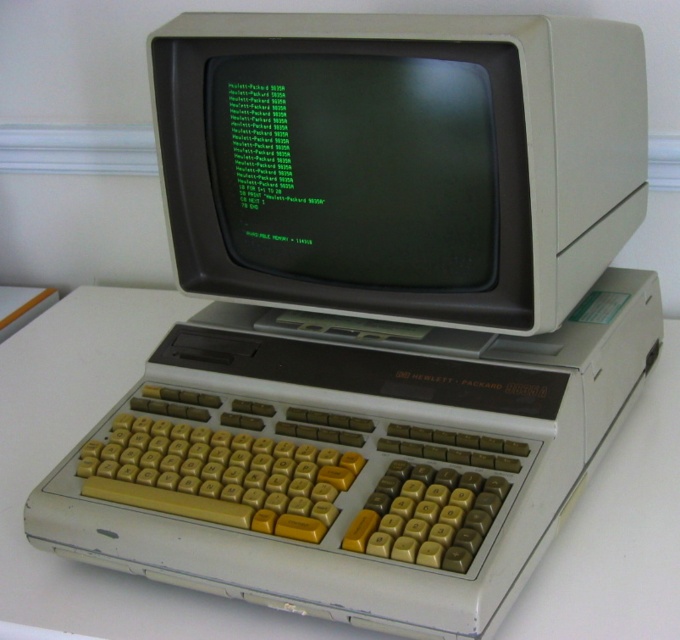
Describe the element at coordinates (401, 161) in the screenshot. I see `beige plastic monitor at center` at that location.

Between beige plastic monitor at center and green matte monitor at center, which one has more height?

Standing taller between the two is beige plastic monitor at center.

Find the location of a particular element. Image resolution: width=680 pixels, height=640 pixels. beige plastic monitor at center is located at coordinates (401, 161).